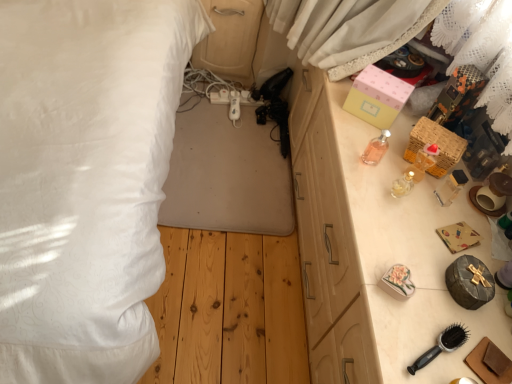
Where is `vacant area that lies between black plastic hairbrush at lower right and pink paper box at upper right, which ranks as the 1th box in top-to-bottom order`? The image size is (512, 384). vacant area that lies between black plastic hairbrush at lower right and pink paper box at upper right, which ranks as the 1th box in top-to-bottom order is located at coordinates (391, 216).